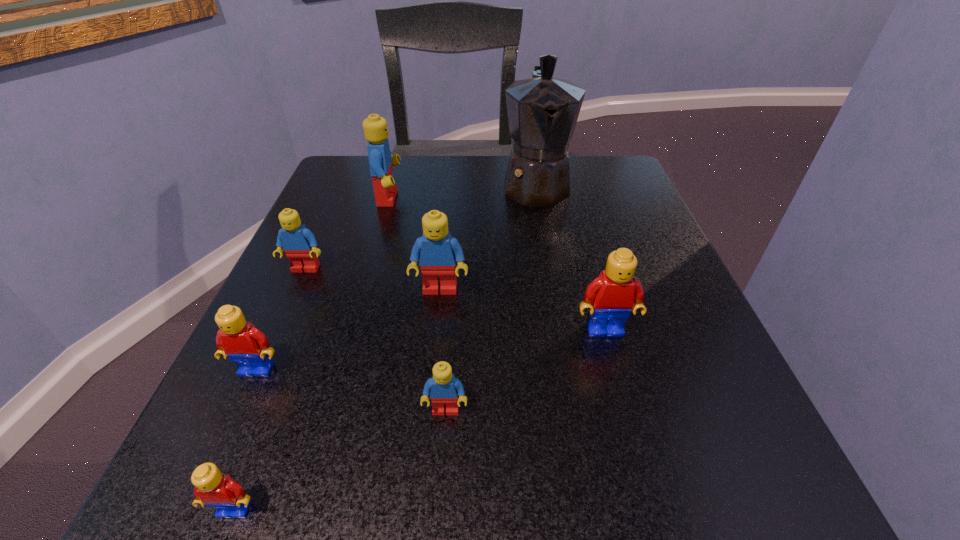
Image resolution: width=960 pixels, height=540 pixels. I want to click on blue Lego object that ranks as the fourth closest to the coffeepot, so click(443, 388).

Identify the location of the second closest blue Lego to the farthest blue Lego. (437, 252).

Select which yellow Lego is the third closest to the coffeepot. Please provide its 2D coordinates. Your answer should be formatted as a tuple, i.e. [(x, y)], where the tuple contains the x and y coordinates of a point satisfying the conditions above.

[(212, 488)]

Identify the location of the third closest yellow Lego to the coffeepot. Image resolution: width=960 pixels, height=540 pixels. (212, 488).

The height and width of the screenshot is (540, 960). I want to click on free space in the image that satisfies the following two spatial constraints: 1. on the pouring side of the coffeepot; 2. on the face of the third blue Lego from right to left, so click(538, 198).